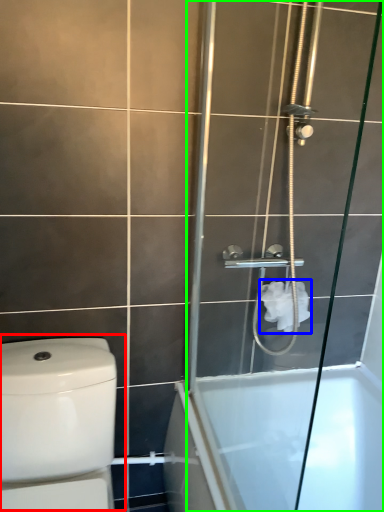
Question: Which object is positioned farthest from toilet (highlighted by a red box)? Select from toilet paper (highlighted by a blue box) and screen door (highlighted by a green box).

Choices:
 (A) toilet paper
 (B) screen door

Answer: (A)